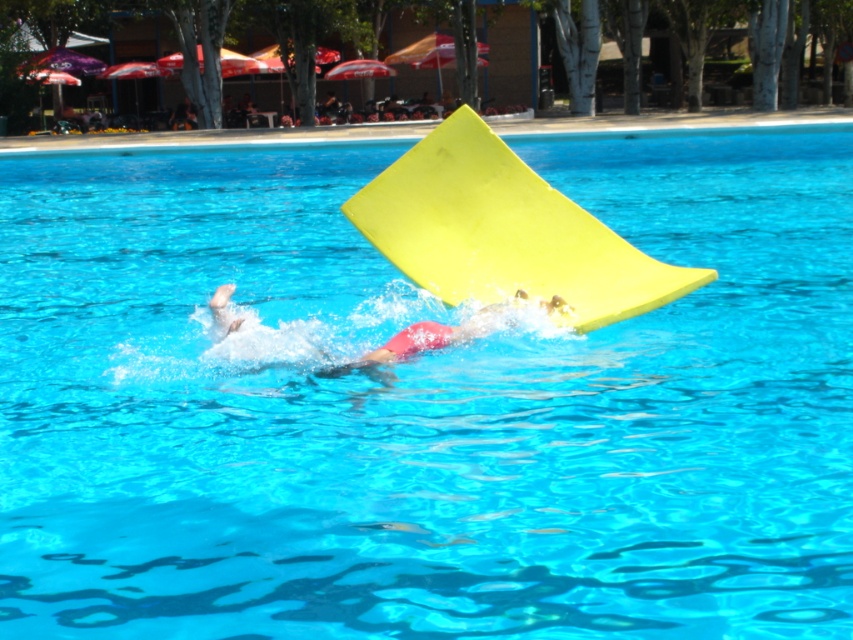
Question: Which of the following is the closest to the observer?

Choices:
 (A) yellow foam slide at center
 (B) red matte swimmer at center

Answer: (B)

Question: Among these points, which one is nearest to the camera?

Choices:
 (A) (575, 259)
 (B) (428, 339)

Answer: (B)

Question: Considering the relative positions of yellow foam slide at center and red matte swimmer at center in the image provided, where is yellow foam slide at center located with respect to red matte swimmer at center?

Choices:
 (A) below
 (B) above

Answer: (B)

Question: Is yellow foam slide at center to the left of red matte swimmer at center from the viewer's perspective?

Choices:
 (A) yes
 (B) no

Answer: (B)

Question: Which point is farther to the camera?

Choices:
 (A) yellow foam slide at center
 (B) red matte swimmer at center

Answer: (A)

Question: Considering the relative positions of yellow foam slide at center and red matte swimmer at center in the image provided, where is yellow foam slide at center located with respect to red matte swimmer at center?

Choices:
 (A) above
 (B) below

Answer: (A)